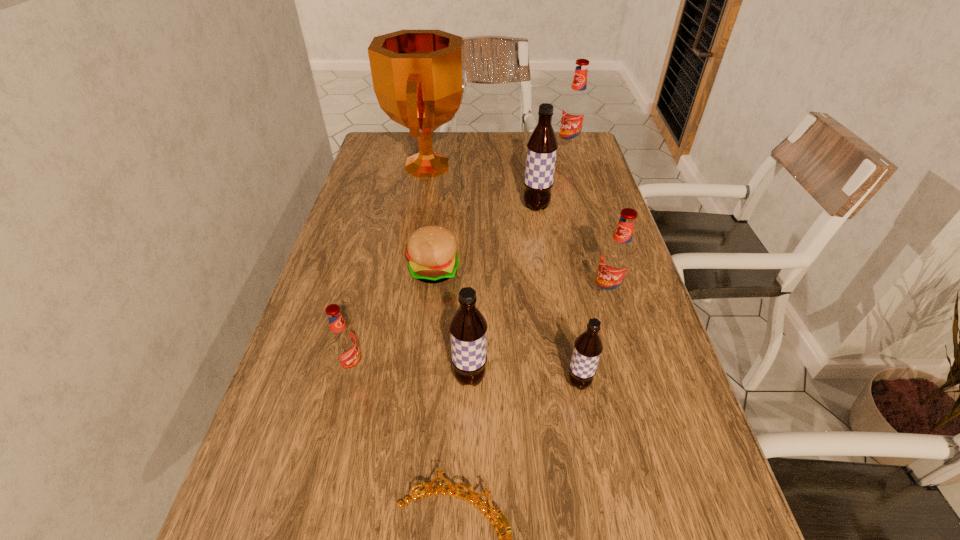
Where is `vacant space that satisfies the following two spatial constraints: 1. on the side of the gold award with the star emblem; 2. on the back side of the beige hamburger`? This screenshot has height=540, width=960. vacant space that satisfies the following two spatial constraints: 1. on the side of the gold award with the star emblem; 2. on the back side of the beige hamburger is located at coordinates (413, 270).

I want to click on vacant space that satisfies the following two spatial constraints: 1. on the back side of the second nearest red root beer; 2. on the side of the award with the star emblem, so click(x=569, y=166).

Where is `free region that satisfies the following two spatial constraints: 1. on the back side of the fifth nearest root beer; 2. on the right side of the hamburger`? free region that satisfies the following two spatial constraints: 1. on the back side of the fifth nearest root beer; 2. on the right side of the hamburger is located at coordinates (441, 207).